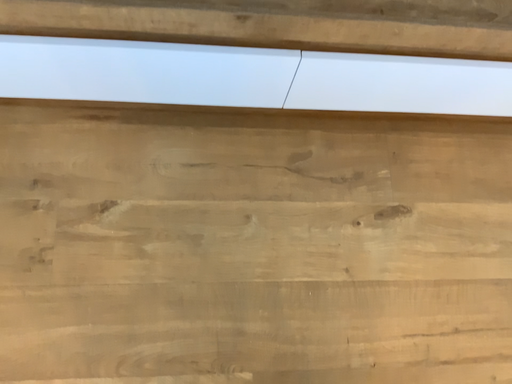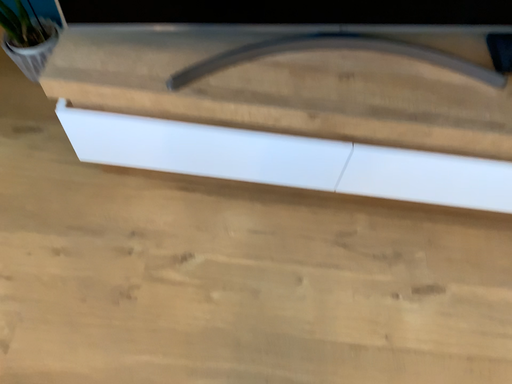
Question: Which way did the camera rotate in the video?

Choices:
 (A) rotated downward
 (B) rotated upward

Answer: (B)